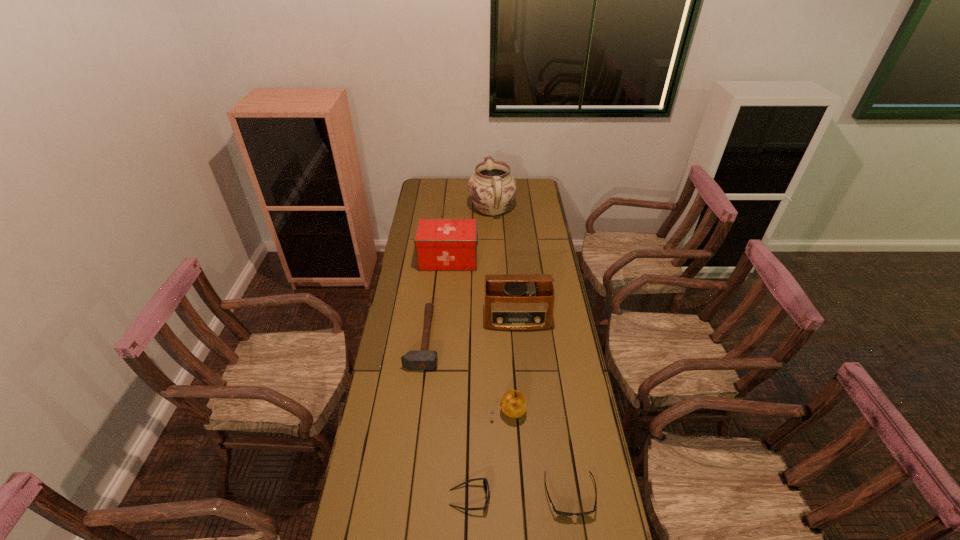
In order to click on empty location between the left sunglasses and the third shortest object in this screenshot , I will do `click(446, 418)`.

This screenshot has width=960, height=540. Find the location of `unoccupied position between the first-aid kit and the fourth shortest object`. unoccupied position between the first-aid kit and the fourth shortest object is located at coordinates (478, 336).

Locate an element on the screen. free space between the sixth tallest object and the third tallest object is located at coordinates (459, 379).

In order to click on vacant space in between the hammer and the sixth nearest object in this screenshot , I will do `click(436, 299)`.

I want to click on free space between the third shortest object and the taller sunglasses, so click(446, 418).

This screenshot has width=960, height=540. In order to click on object that is the second closest one to the hammer in this screenshot , I will do `click(513, 403)`.

Point out which object is positioned as the sixth nearest to the fourth tallest object. Please provide its 2D coordinates. Your answer should be formatted as a tuple, i.e. [(x, y)], where the tuple contains the x and y coordinates of a point satisfying the conditions above.

[(492, 188)]

This screenshot has width=960, height=540. What are the coordinates of `vacant space that satisfies the following two spatial constraints: 1. on the striking surface of the hammer; 2. on the right side of the pear` in the screenshot? It's located at (415, 411).

Locate an element on the screen. vacant space that satisfies the following two spatial constraints: 1. on the handle side of the second farthest object; 2. on the back side of the fourth tallest object is located at coordinates (435, 411).